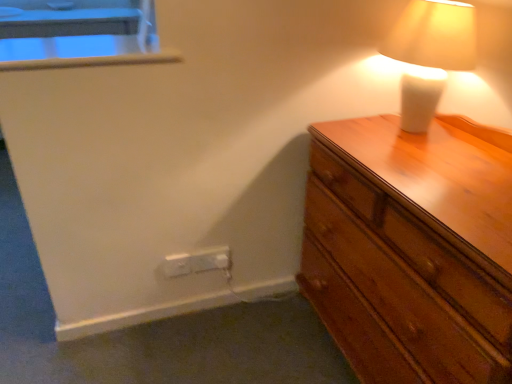
Question: Would you say white plastic window sill at upper left is inside or outside white ceramic lamp at upper right?

Choices:
 (A) inside
 (B) outside

Answer: (B)

Question: Considering the relative positions of white plastic window sill at upper left and white ceramic lamp at upper right in the image provided, is white plastic window sill at upper left to the left or to the right of white ceramic lamp at upper right?

Choices:
 (A) left
 (B) right

Answer: (A)

Question: Considering the real-world distances, which object is closest to the wooden chest of drawers at right?

Choices:
 (A) white plastic electric outlet at lower center, which ranks as the first electric outlet in right-to-left order
 (B) white plastic window sill at upper left
 (C) white ceramic lamp at upper right
 (D) white plastic electric outlet at lower left, the first electric outlet from the left

Answer: (C)

Question: Estimate the real-world distances between objects in this image. Which object is farther from the white plastic window sill at upper left?

Choices:
 (A) white ceramic lamp at upper right
 (B) white plastic electric outlet at lower left, the first electric outlet from the left
 (C) white plastic electric outlet at lower center, the second electric outlet positioned from the left
 (D) wooden chest of drawers at right

Answer: (D)